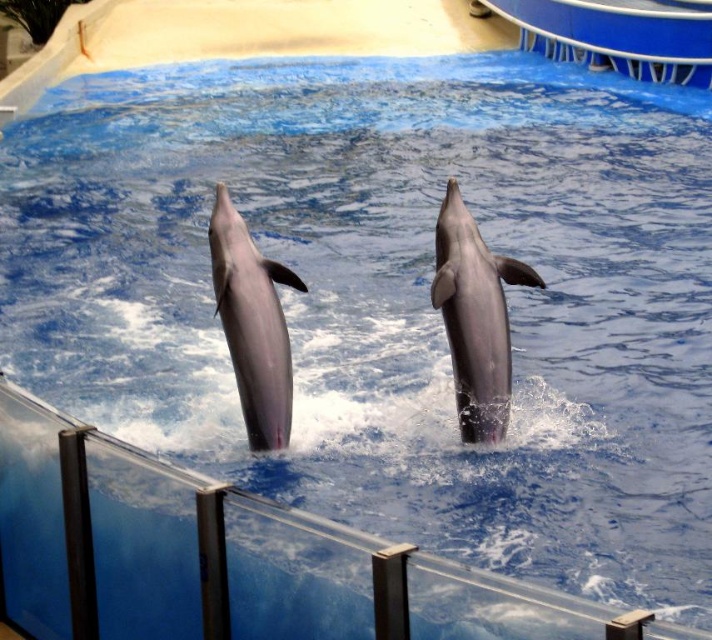
Question: Which object is closer to the camera taking this photo?

Choices:
 (A) gray smooth dolphin at center
 (B) pink smooth dolphin at center

Answer: (A)

Question: Is gray smooth dolphin at center wider than pink smooth dolphin at center?

Choices:
 (A) no
 (B) yes

Answer: (B)

Question: Is gray smooth dolphin at center to the right of pink smooth dolphin at center from the viewer's perspective?

Choices:
 (A) no
 (B) yes

Answer: (B)

Question: Is gray smooth dolphin at center thinner than pink smooth dolphin at center?

Choices:
 (A) no
 (B) yes

Answer: (A)

Question: Which point is closer to the camera?

Choices:
 (A) gray smooth dolphin at center
 (B) pink smooth dolphin at center

Answer: (A)